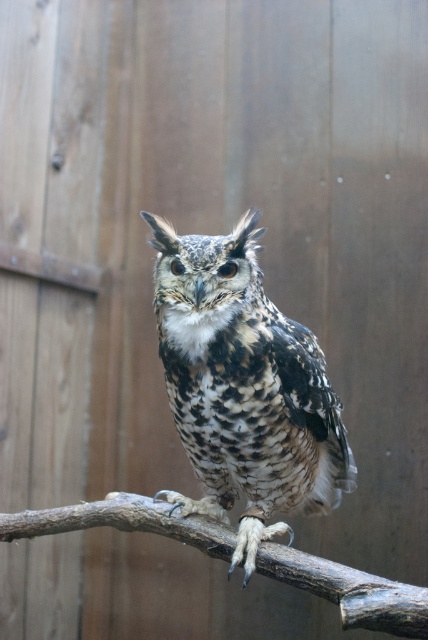
You are a wildlife photographer holding a camera with a lens that has a minimum focusing distance of 25 centimeters. You are trying to take a closeup photo of the speckled feathered owl at center while avoiding the brown rough tree branch at center from appearing in the shot. Based on the scene description, can you get a clear shot of the owl without the branch being in the frame?

The distance between the speckled feathered owl at center and brown rough tree branch at center is 24.17 centimeters, which is less than the camera lens minimum focusing distance of 25 centimeters. Therefore, you cannot get a clear shot of the speckled feathered owl at center without the brown rough tree branch at center appearing in the frame because the distance is too close for the lens to focus properly.

You are a photographer trying to capture the owl in the center of the image. The camera has a focus point at coordinate point (243, 387). Will this focus point align with the owl?

Yes, the point (243, 387) corresponds to the speckled feathered owl at center, so the focus point will align with the owl.

You are a birdwatcher observing the speckled feathered owl at center and the brown rough tree branch at center. Which object takes up more space in the image?

The speckled feathered owl at center has a larger size compared to the brown rough tree branch at center, so it takes up more space in the image.